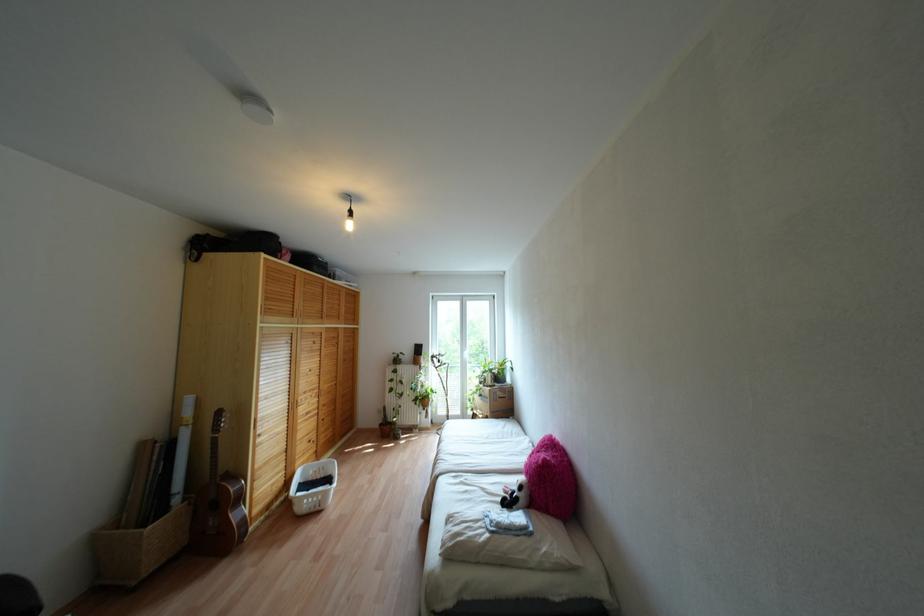
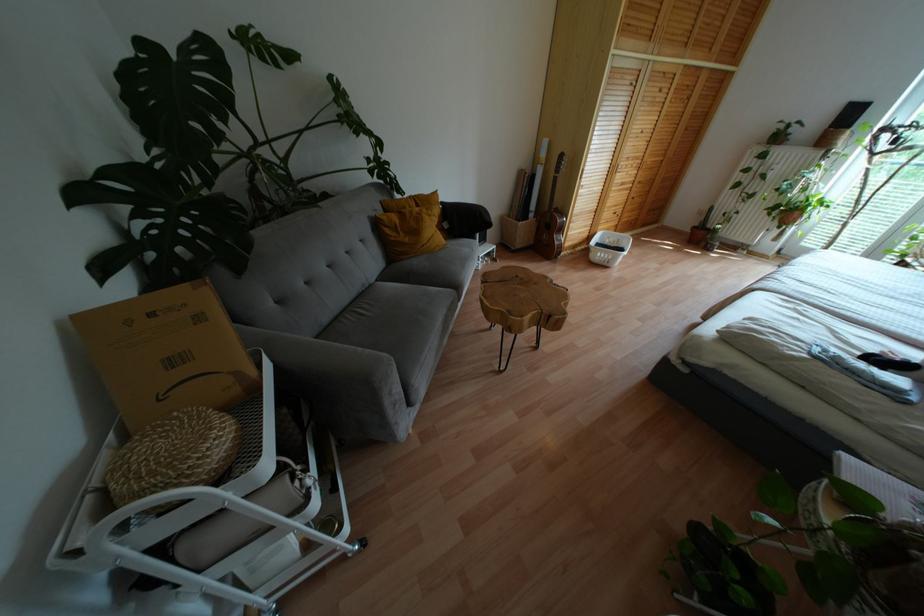
Find the pixel in the second image that matches (380,424) in the first image.

(694, 227)